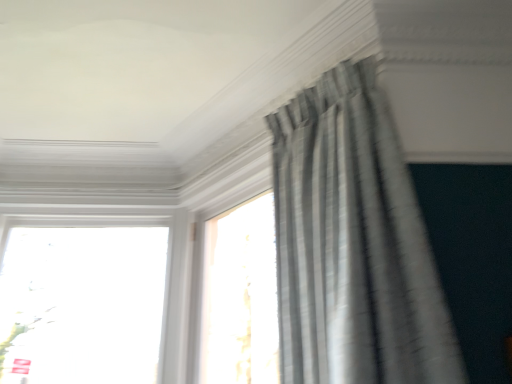
What do you see at coordinates (353, 244) in the screenshot? I see `satin gray curtain at upper right` at bounding box center [353, 244].

At what (x,y) coordinates should I click in order to perform the action: click on satin gray curtain at upper right. Please return your answer as a coordinate pair (x, y). The image size is (512, 384). Looking at the image, I should click on (353, 244).

The image size is (512, 384). I want to click on satin gray curtain at upper right, so click(353, 244).